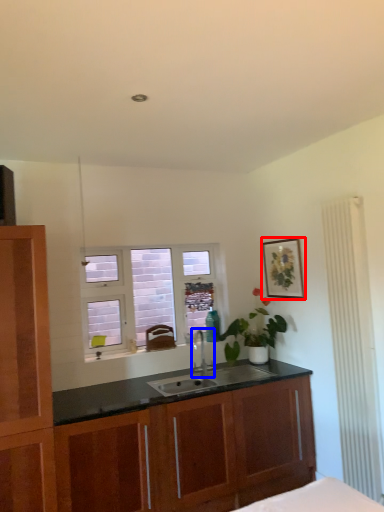
Question: Which object is closer to the camera taking this photo, picture frame (highlighted by a red box) or tap (highlighted by a blue box)?

Choices:
 (A) picture frame
 (B) tap

Answer: (B)